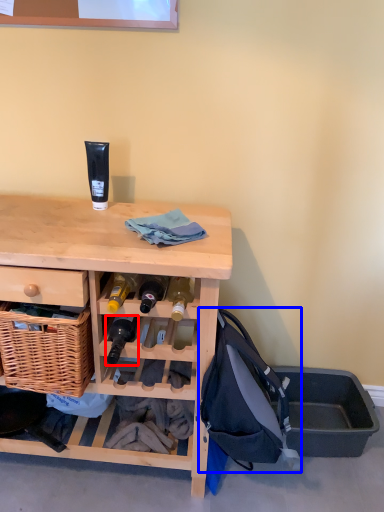
Question: Which of the following is the closest to the observer, bottle (highlighted by a red box) or backpack (highlighted by a blue box)?

Choices:
 (A) bottle
 (B) backpack

Answer: (B)